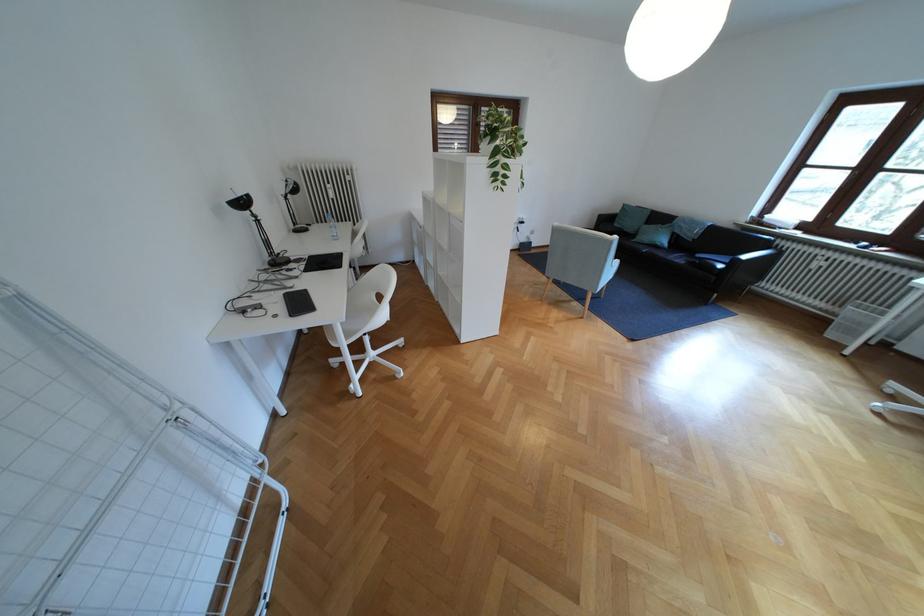
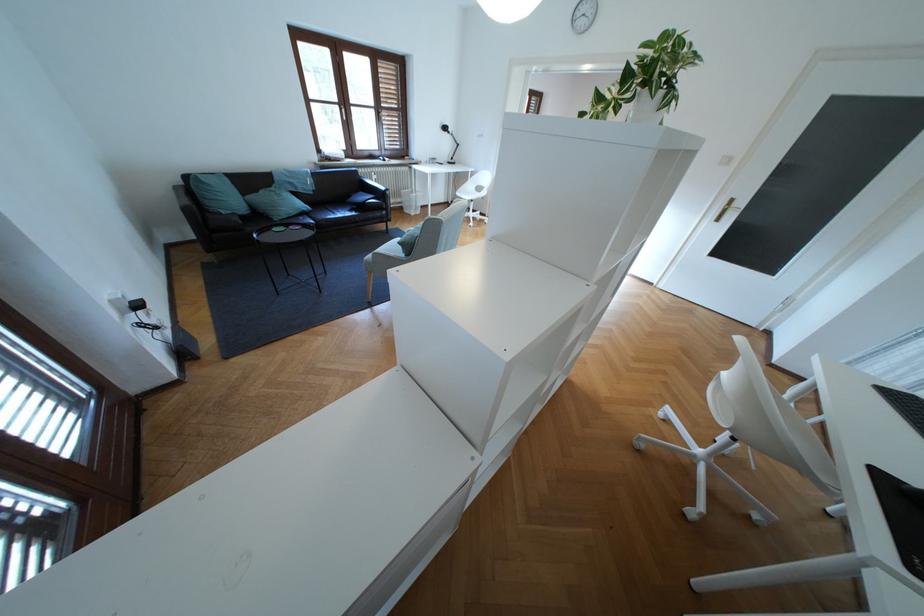
The point at [626,225] is marked in the first image. Where is the corresponding point in the second image?

(234, 213)